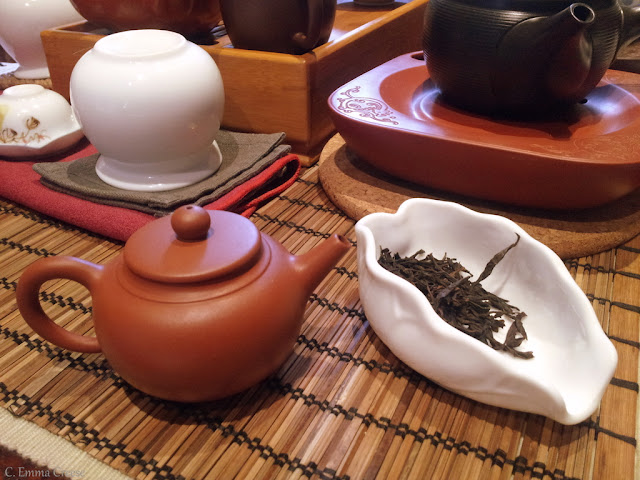
Locate an element on the screen. This screenshot has width=640, height=480. dark brown dishes is located at coordinates (246, 18), (456, 57).